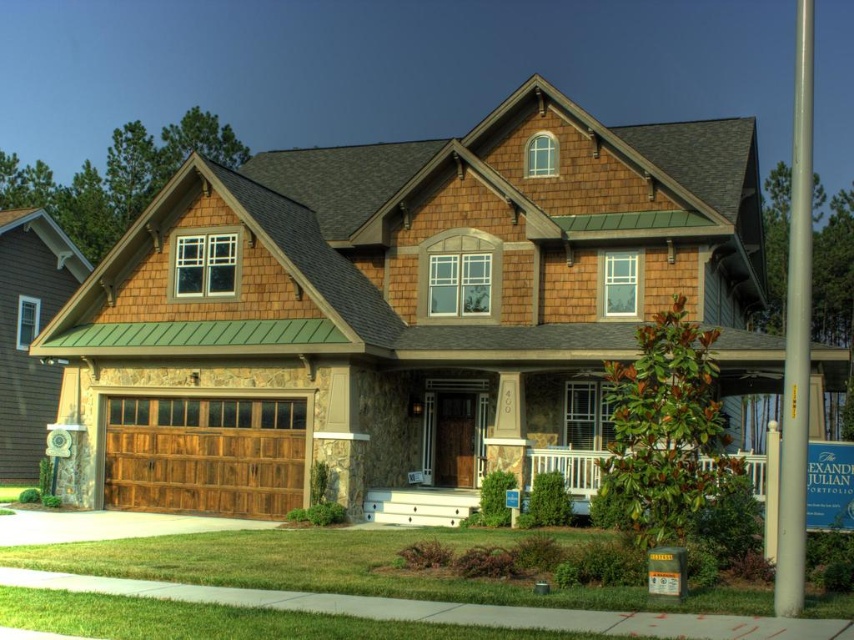
Looking at this image, based on the provided image description, which object corresponds to the coordinates point (401, 308)?

The wooden garage door at left corresponds to the coordinates point (401, 308).

You are standing in front of the house and need to find the entrance. Which object is closer to the main entrance? The wooden garage door at left or the white stone porch at center?

The white stone porch at center is closer to the main entrance because the wooden garage door at left is to the left of it, placing the porch nearer to the entrance area.

You are standing in front of the house and want to walk to the white stone porch at center. Which direction should you go relative to the wooden at left?

The white stone porch at center is behind the wooden at left, so you should walk towards the back of the wooden at left to reach it.